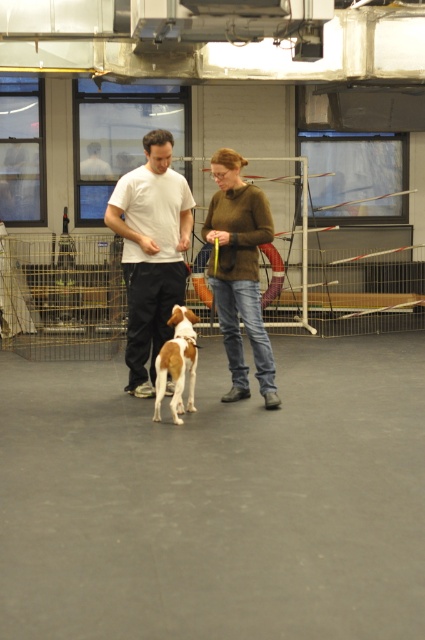
Is white matte t-shirt at center smaller than brown and white fur dog at center?

No, white matte t-shirt at center is not smaller than brown and white fur dog at center.

What do you see at coordinates (150, 252) in the screenshot? The width and height of the screenshot is (425, 640). I see `white matte t-shirt at center` at bounding box center [150, 252].

Where is `white matte t-shirt at center`? white matte t-shirt at center is located at coordinates (150, 252).

This screenshot has height=640, width=425. Describe the element at coordinates (150, 252) in the screenshot. I see `white matte t-shirt at center` at that location.

Does white matte t-shirt at center appear over matte brown sweater at center?

Indeed, white matte t-shirt at center is positioned over matte brown sweater at center.

Is point (130, 244) farther from viewer compared to point (237, 342)?

Yes.

Find the location of a particular element. This screenshot has width=425, height=640. white matte t-shirt at center is located at coordinates (150, 252).

Who is more distant from viewer, (218, 264) or (192, 385)?

Point (218, 264)

Is matte brown sweater at center taller than brown and white fur dog at center?

Indeed, matte brown sweater at center has a greater height compared to brown and white fur dog at center.

Is point (226, 401) in front of point (184, 365)?

No, (226, 401) is further to viewer.

Locate an element on the screen. The image size is (425, 640). matte brown sweater at center is located at coordinates (240, 273).